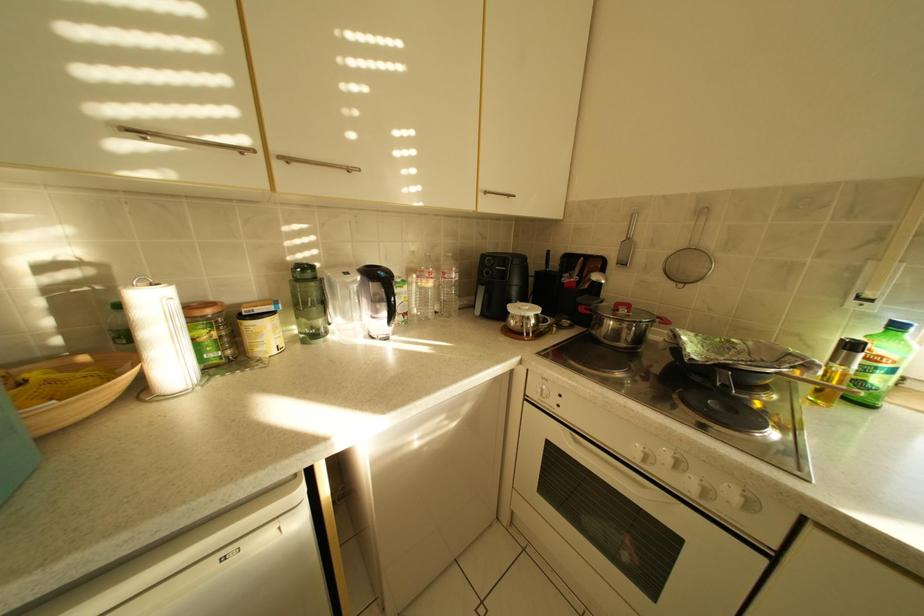
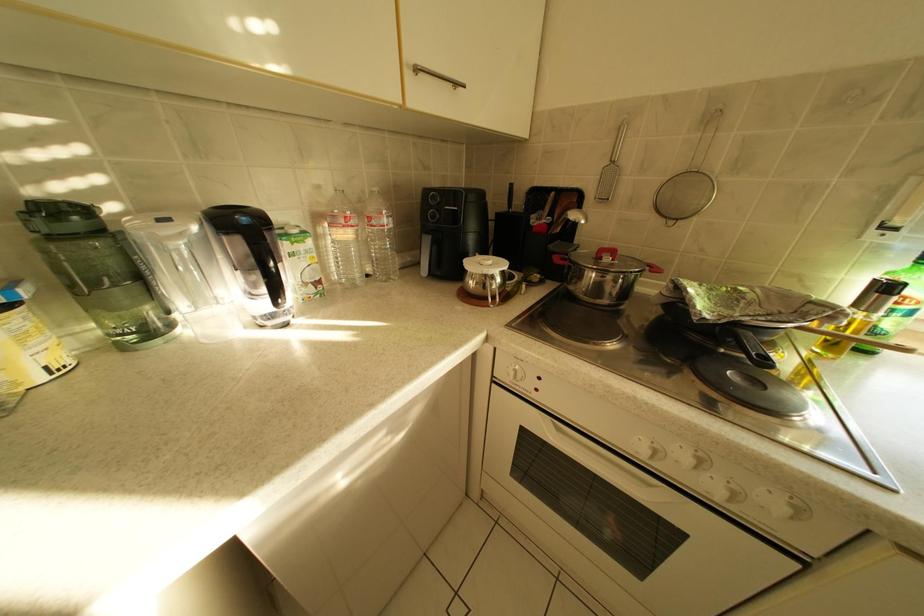
Question: The images are taken continuously from a first-person perspective. In which direction is your viewpoint rotating?

Choices:
 (A) Left
 (B) Right
 (C) Up
 (D) Down

Answer: (D)